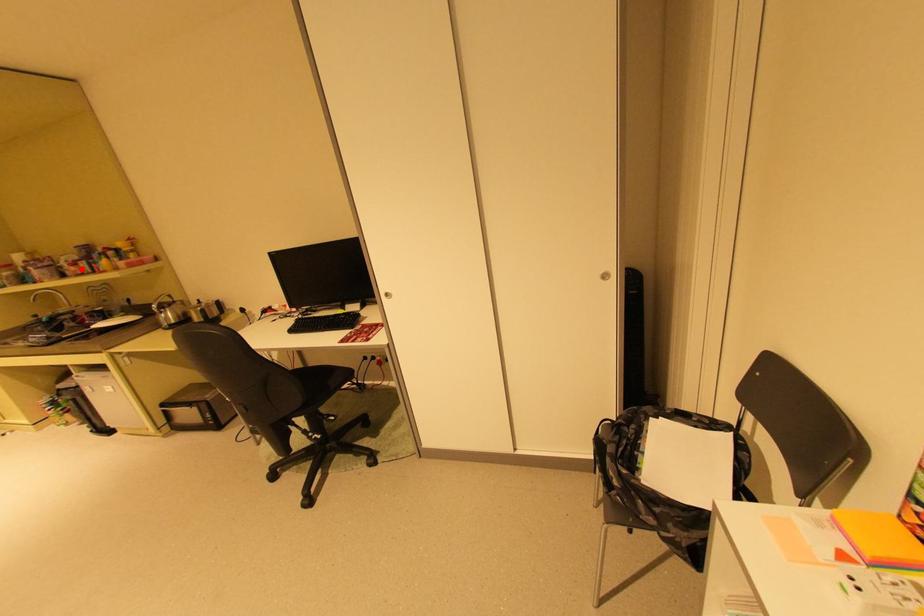
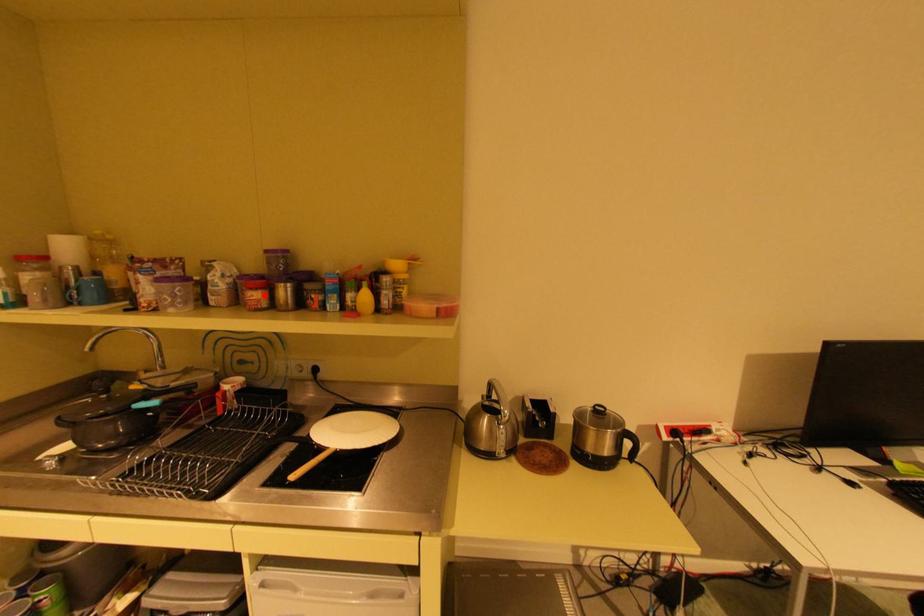
I am providing you with two images of the same scene from different viewpoints. A red point is marked on the first image and another point is marked on the second image. Do the highlighted points in image1 and image2 indicate the same real-world spot?

Yes